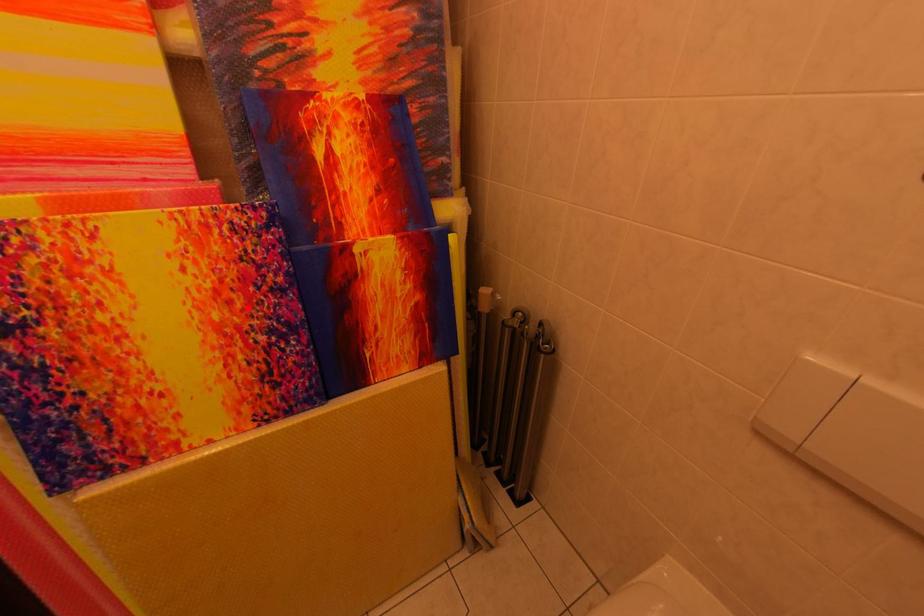
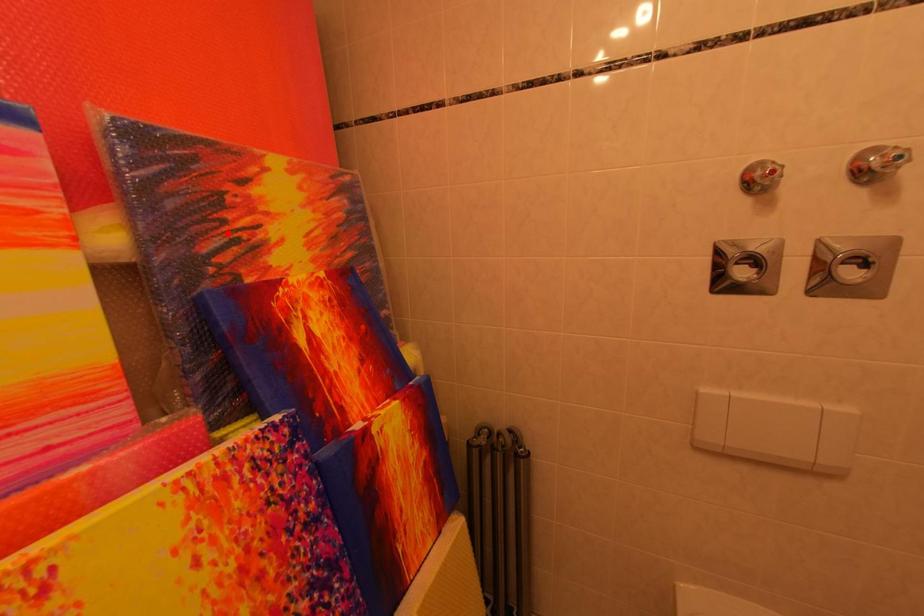
Consider the image. I am providing you with two images of the same scene from different viewpoints. A red point is marked on the first image and another point is marked on the second image. Is the marked point in image1 the same physical position as the marked point in image2?

No